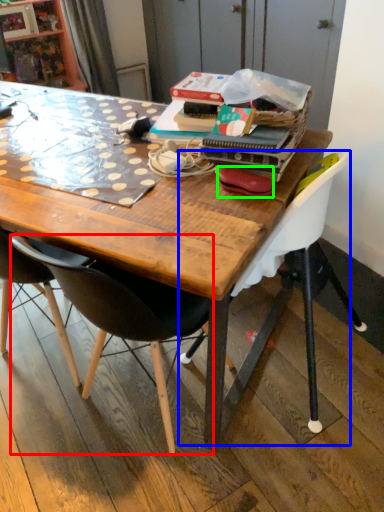
Question: Considering the real-world distances, which object is closest to chair (highlighted by a red box)? chair (highlighted by a blue box) or handbag (highlighted by a green box).

Choices:
 (A) chair
 (B) handbag

Answer: (A)